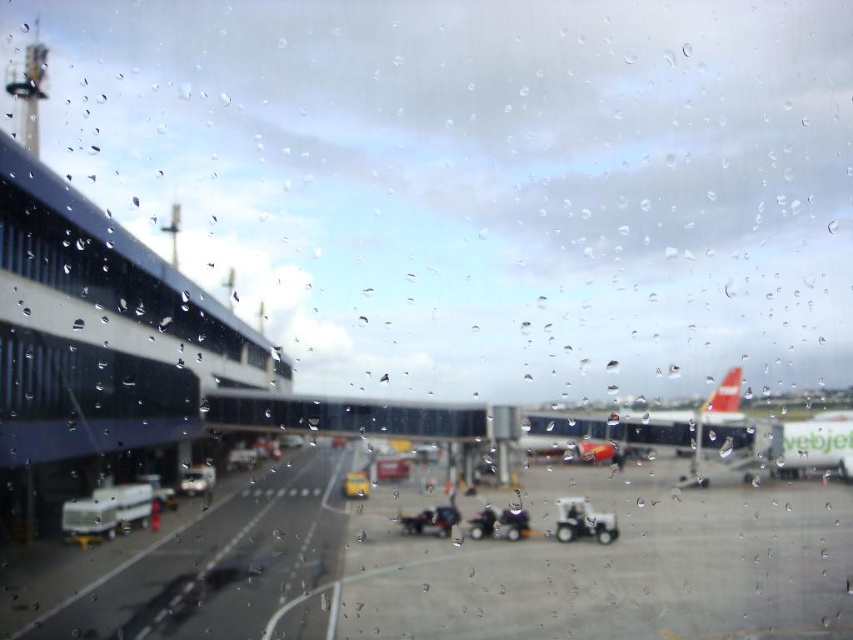
You are an airport staff member needing to move a heavy item from the metallic silver car at lower left to the metallic silver cart at center. Which direction should you move the item to place it on the cart?

You should move the item downward to place it on the metallic silver cart at center since it is positioned under the metallic silver car at lower left.

You are an airport employee who needs to check the height clearance between the smooth asphalt tarmac at center and the metallic silver cart at center. Based on the scene, can the cart pass under a low hanging structure that the tarmac is under without hitting it?

The smooth asphalt tarmac at center is taller than metallic silver cart at center, so the metallic silver cart at center is shorter and can pass under the low hanging structure without hitting it.

You are at the airport and want to find the metallic silver cart at center. Which object is located at the coordinate point [498,522]?

The point [498,522] is on the metallic silver cart at center.